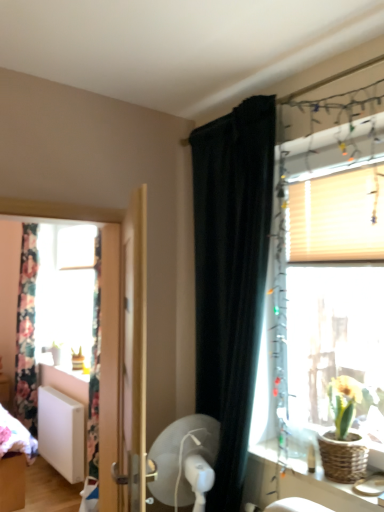
Question: Is point (28, 266) positioned closer to the camera than point (120, 403)?

Choices:
 (A) closer
 (B) farther

Answer: (B)

Question: From the image's perspective, is floral fabric curtain at left, the first curtain positioned from the left, positioned above or below wooden door at center?

Choices:
 (A) below
 (B) above

Answer: (A)

Question: Which object is positioned closest to the black velvet curtain at upper center, which appears as the second curtain when viewed from the left?

Choices:
 (A) floral fabric curtain at left, the first curtain positioned from the left
 (B) translucent wood window at right
 (C) white matte radiator at lower left
 (D) white plastic fan at center
 (E) wooden door at center

Answer: (B)

Question: Estimate the real-world distances between objects in this image. Which object is closer to the white plastic fan at center?

Choices:
 (A) floral fabric curtain at left, the 2th curtain when ordered from front to back
 (B) wooden door at center
 (C) white matte radiator at lower left
 (D) green woven basket at right
 (E) woven wicker vanity at lower right

Answer: (B)